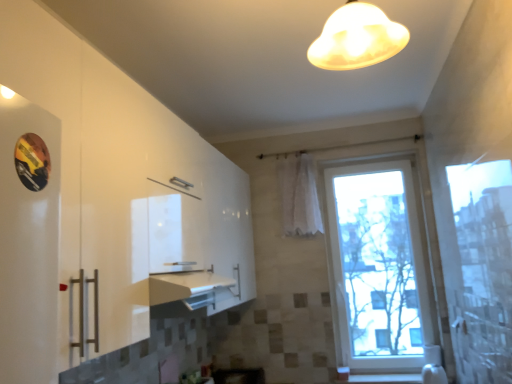
Question: Considering the positions of white sheer curtain at center and matte glass lampshade at upper center in the image, is white sheer curtain at center bigger or smaller than matte glass lampshade at upper center?

Choices:
 (A) big
 (B) small

Answer: (A)

Question: Would you say white sheer curtain at center is to the left or to the right of matte glass lampshade at upper center in the picture?

Choices:
 (A) right
 (B) left

Answer: (A)

Question: Which object is positioned farthest from the matte glass lampshade at upper center?

Choices:
 (A) white sheer curtain at center
 (B) transparent glass window at center

Answer: (B)

Question: Considering the real-world distances, which object is farthest from the transparent glass window at center?

Choices:
 (A) white sheer curtain at center
 (B) matte glass lampshade at upper center

Answer: (B)